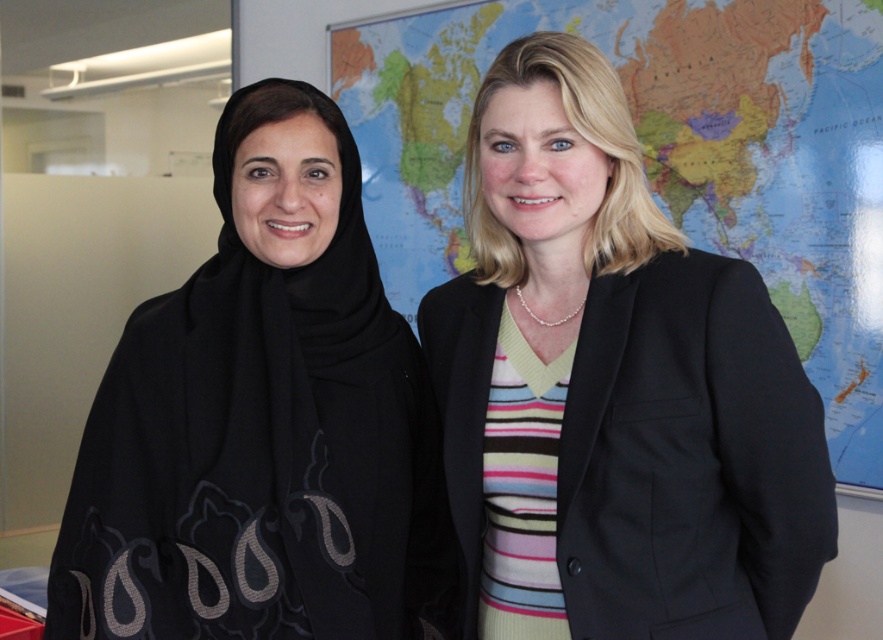
You are an architect designing a virtual reality office space. You need to place a holographic map on the wall where the black matte scarf at left is currently located. What are the coordinates for placing the holographic map?

The coordinates for placing the holographic map where the black matte scarf at left is located are at point (263,422).

You are an office worker who needs to place a new poster on the wall. You have two points marked on the wall where you can hang it. The first point is at coordinates point (136, 602) and the second is at point (767, 1). Which point is closer to the viewer?

Point (136, 602) is in front of point (767, 1), so it is closer to the viewer.

You are an office worker who needs to hang a 4 feet wide poster on the wall. You see the black matte scarf at left and the map at center. Which object is closer to where you should place the top edge of the poster to ensure it doesn

The black matte scarf at left is 4.61 feet from the map at center. To place the top edge of the 4 feet wide poster, you should position it closer to the map at center since the distance between them allows enough space.